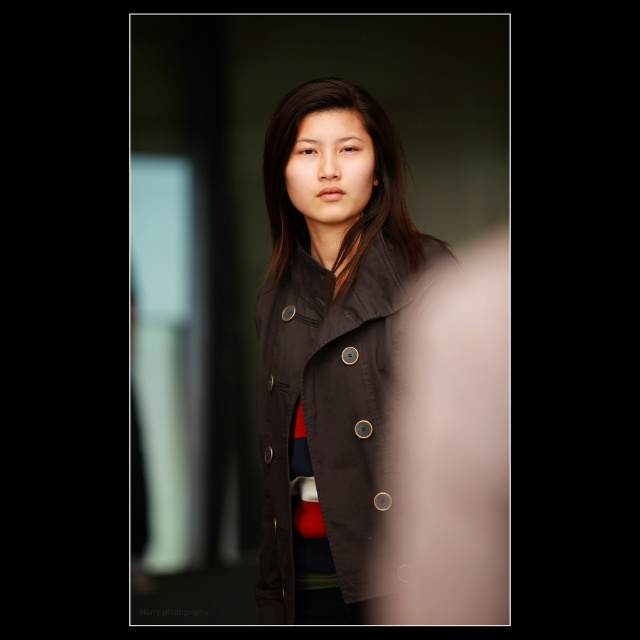
Question: Which of the following is the farthest from the observer?

Choices:
 (A) matte brown jacket at center
 (B) matte black coat at center

Answer: (B)

Question: Which of the following is the farthest from the observer?

Choices:
 (A) (365, 374)
 (B) (292, 252)

Answer: (B)

Question: Does matte brown jacket at center appear over matte black coat at center?

Choices:
 (A) yes
 (B) no

Answer: (B)

Question: Can you confirm if matte brown jacket at center is wider than matte black coat at center?

Choices:
 (A) yes
 (B) no

Answer: (A)

Question: Is matte brown jacket at center thinner than matte black coat at center?

Choices:
 (A) no
 (B) yes

Answer: (A)